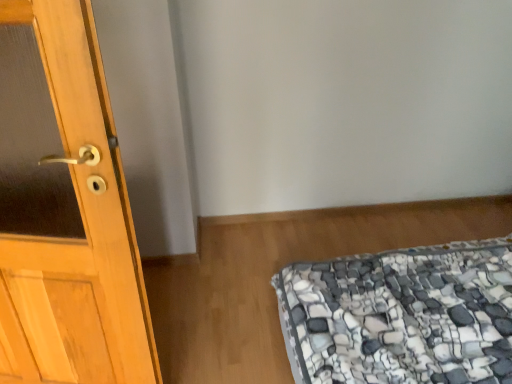
Question: From the image's perspective, is light wood door at left on stone-patterned fabric at lower right?

Choices:
 (A) no
 (B) yes

Answer: (B)

Question: Is light wood door at left with stone-patterned fabric at lower right?

Choices:
 (A) yes
 (B) no

Answer: (B)

Question: Is light wood door at left located outside stone-patterned fabric at lower right?

Choices:
 (A) yes
 (B) no

Answer: (A)

Question: From a real-world perspective, is light wood door at left over stone-patterned fabric at lower right?

Choices:
 (A) no
 (B) yes

Answer: (B)

Question: Does light wood door at left have a lesser width compared to stone-patterned fabric at lower right?

Choices:
 (A) no
 (B) yes

Answer: (B)

Question: Is light wood door at left looking in the opposite direction of stone-patterned fabric at lower right?

Choices:
 (A) no
 (B) yes

Answer: (A)

Question: Does stone-patterned fabric at lower right appear on the left side of light wood door at left?

Choices:
 (A) no
 (B) yes

Answer: (A)

Question: Is stone-patterned fabric at lower right next to light wood door at left?

Choices:
 (A) yes
 (B) no

Answer: (B)

Question: Is stone-patterned fabric at lower right far away from light wood door at left?

Choices:
 (A) no
 (B) yes

Answer: (A)

Question: Does stone-patterned fabric at lower right appear on the right side of light wood door at left?

Choices:
 (A) no
 (B) yes

Answer: (B)

Question: Considering the relative sizes of stone-patterned fabric at lower right and light wood door at left in the image provided, is stone-patterned fabric at lower right taller than light wood door at left?

Choices:
 (A) no
 (B) yes

Answer: (A)

Question: Considering the relative sizes of stone-patterned fabric at lower right and light wood door at left in the image provided, is stone-patterned fabric at lower right smaller than light wood door at left?

Choices:
 (A) no
 (B) yes

Answer: (A)

Question: In terms of width, does light wood door at left look wider or thinner when compared to stone-patterned fabric at lower right?

Choices:
 (A) wide
 (B) thin

Answer: (B)